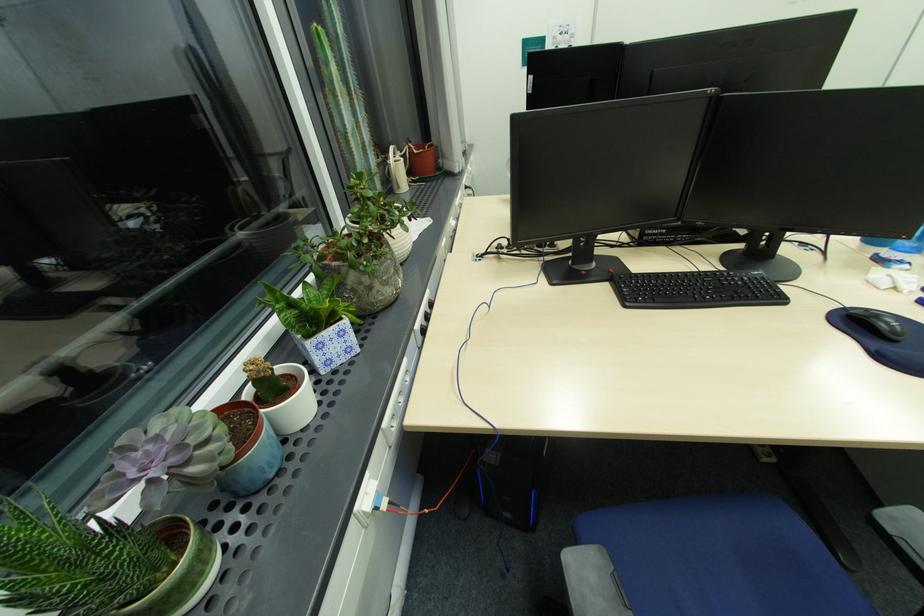
This screenshot has width=924, height=616. Describe the element at coordinates (881, 310) in the screenshot. I see `the mouse right button` at that location.